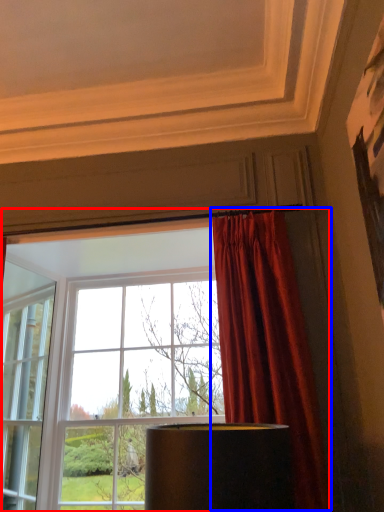
Question: Which of the following is the farthest to the observer, window (highlighted by a red box) or curtain (highlighted by a blue box)?

Choices:
 (A) window
 (B) curtain

Answer: (A)